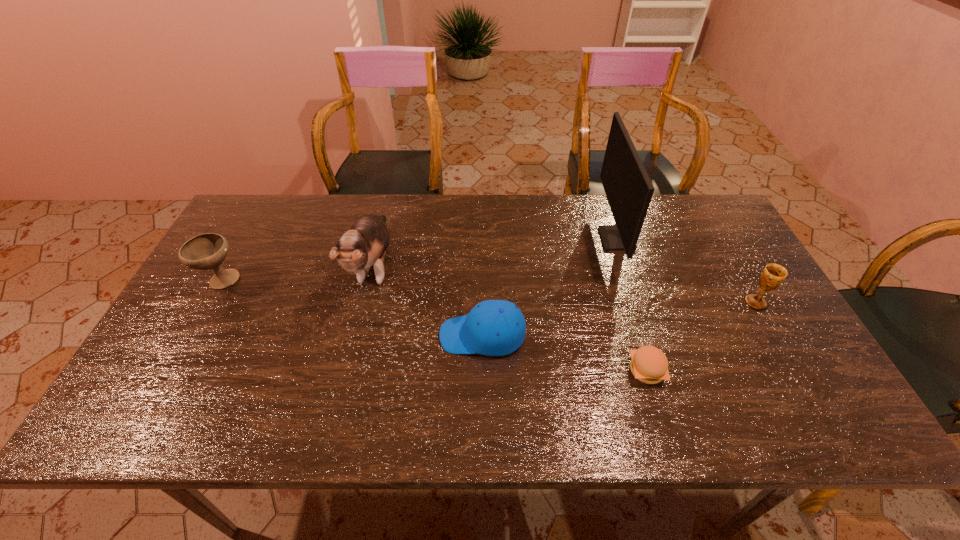
You are a GUI agent. You are given a task and a screenshot of the screen. Output one action in this format:
    pyautogui.click(x=<x>, y=<y>)
    Task: Click on the object at the left edge
    The image size is (960, 540).
    Given the screenshot: What is the action you would take?
    pos(207,251)

Identify the location of object located at the right edge. This screenshot has height=540, width=960. (773, 275).

In the image, there is a desktop. Where is `free region at the far edge`? free region at the far edge is located at coordinates (292, 219).

In the image, there is a desktop. Where is `vacant space at the near edge`? vacant space at the near edge is located at coordinates (644, 429).

Find the location of a particular element. free space at the right edge of the desktop is located at coordinates (740, 288).

You are a GUI agent. You are given a task and a screenshot of the screen. Output one action in this format:
    pyautogui.click(x=<x>, y=<y>)
    Task: Click on the vacant space at the far left corner of the desktop
    The width and height of the screenshot is (960, 540).
    Given the screenshot: What is the action you would take?
    pyautogui.click(x=291, y=208)

Where is `free region at the near left corner of the desktop`? The height and width of the screenshot is (540, 960). free region at the near left corner of the desktop is located at coordinates (143, 423).

Where is `vacant space at the near right corner`? vacant space at the near right corner is located at coordinates (791, 402).

Locate an element on the screen. vacant region between the rightmost object and the tallest object is located at coordinates pos(686,271).

Locate an element on the screen. The height and width of the screenshot is (540, 960). free space that is in between the right chalice and the hamburger is located at coordinates (701, 337).